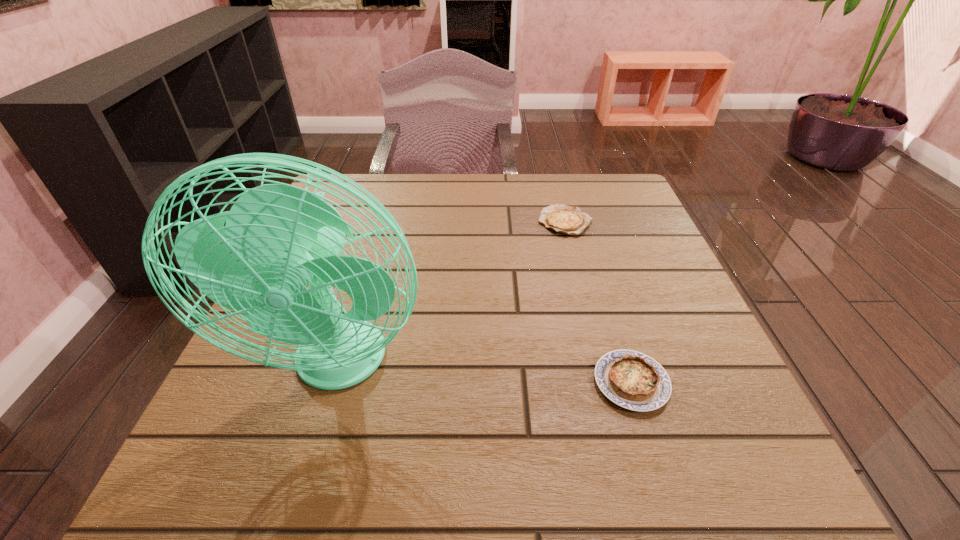
Image resolution: width=960 pixels, height=540 pixels. What are the coordinates of `object situated at the left edge` in the screenshot? It's located at (279, 239).

Locate an element on the screen. Image resolution: width=960 pixels, height=540 pixels. object positioned at the far right corner is located at coordinates (563, 219).

Locate an element on the screen. vacant space at the far edge of the desktop is located at coordinates (534, 181).

Where is `vacant region at the near edge`? The image size is (960, 540). vacant region at the near edge is located at coordinates (510, 468).

In order to click on blank space at the left edge of the desktop in this screenshot , I will do `click(246, 420)`.

The width and height of the screenshot is (960, 540). In the image, there is a desktop. What are the coordinates of `vacant area at the right edge` in the screenshot? It's located at (693, 396).

Locate an element on the screen. blank space at the far left corner of the desktop is located at coordinates (353, 198).

Identify the location of vacant region at the near left corner of the desktop. This screenshot has width=960, height=540. (296, 464).

The width and height of the screenshot is (960, 540). What are the coordinates of `free spot at the far right corner of the desktop` in the screenshot? It's located at (576, 177).

What are the coordinates of `vacant region between the leftmost object and the shortest object` in the screenshot? It's located at (452, 293).